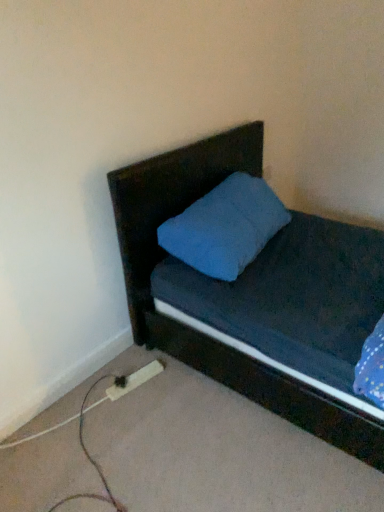
At what (x,y) coordinates should I click in order to perform the action: click on vacant space to the left of wooden extension cord at lower left. Please return your answer as a coordinate pair (x, y). Image resolution: width=384 pixels, height=512 pixels. Looking at the image, I should click on (91, 387).